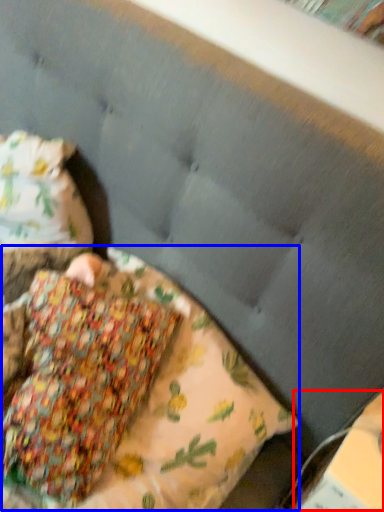
Question: Which of the following is the closest to the observer, paperback book (highlighted by a red box) or pillow (highlighted by a blue box)?

Choices:
 (A) paperback book
 (B) pillow

Answer: (B)